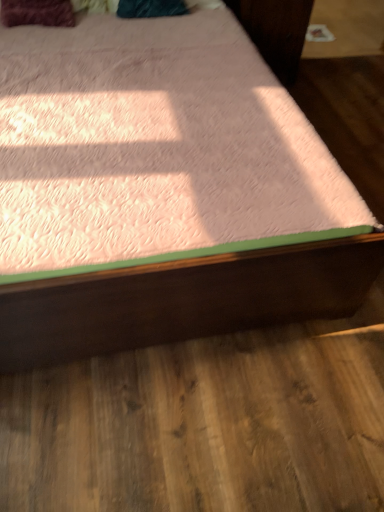
Question: Looking at the image, does pink plush bed at center seem bigger or smaller compared to velvet maroon pillow at upper left?

Choices:
 (A) big
 (B) small

Answer: (A)

Question: Is pink plush bed at center spatially inside velvet maroon pillow at upper left, or outside of it?

Choices:
 (A) outside
 (B) inside

Answer: (A)

Question: Is point (271, 293) positioned closer to the camera than point (44, 17)?

Choices:
 (A) farther
 (B) closer

Answer: (B)

Question: Is velvet maroon pillow at upper left inside the boundaries of pink plush bed at center, or outside?

Choices:
 (A) outside
 (B) inside

Answer: (B)

Question: From a real-world perspective, is velvet maroon pillow at upper left above or below pink plush bed at center?

Choices:
 (A) above
 (B) below

Answer: (A)

Question: From their relative heights in the image, would you say velvet maroon pillow at upper left is taller or shorter than pink plush bed at center?

Choices:
 (A) tall
 (B) short

Answer: (B)

Question: Is velvet maroon pillow at upper left in front of or behind pink plush bed at center in the image?

Choices:
 (A) front
 (B) behind

Answer: (B)